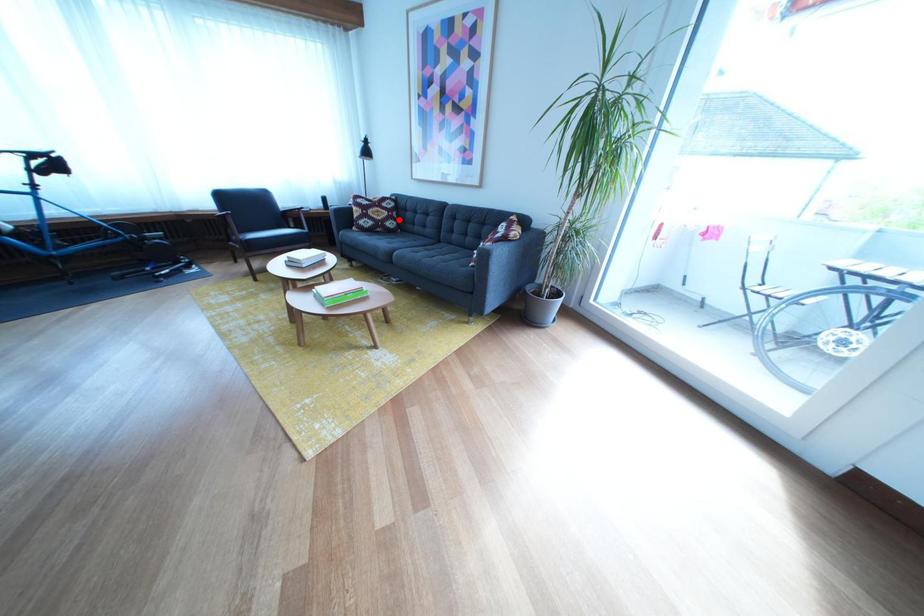
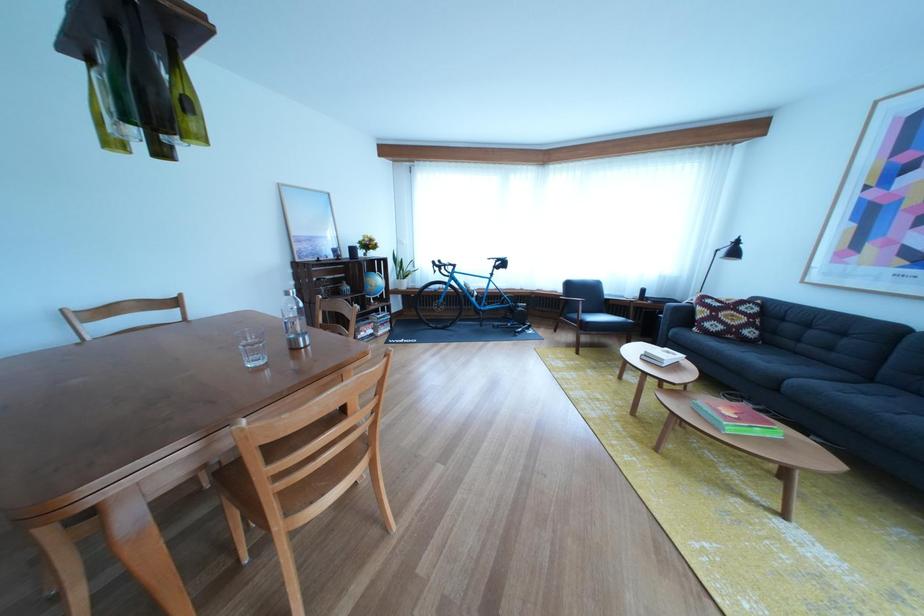
Question: A red point is marked in image1. In image2, is the corresponding 3D point closer to the camera or farther? Reply with the corresponding letter.

Choices:
 (A) The corresponding 3D point is closer.
 (B) The corresponding 3D point is farther.

Answer: (B)